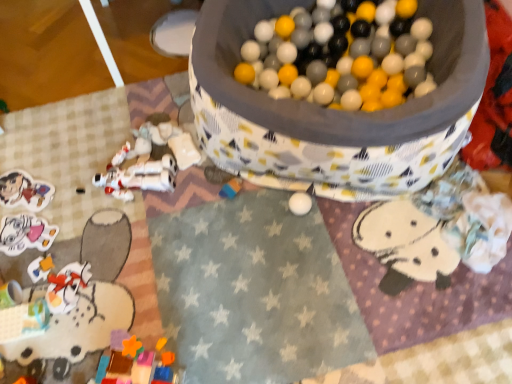
Find the location of `vacant area that lies between matte white sticker at lower left, which appears as the 2th toy when viewed from the left, and fluffy white blanket at lower right, which appears as the sixth toy when viewed from the left`. vacant area that lies between matte white sticker at lower left, which appears as the 2th toy when viewed from the left, and fluffy white blanket at lower right, which appears as the sixth toy when viewed from the left is located at coordinates (241, 239).